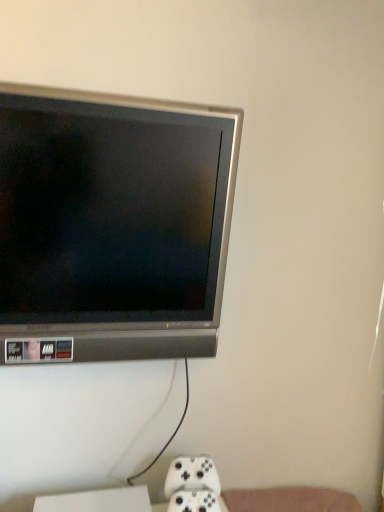
Question: In terms of width, does satin silver television at upper left look wider or thinner when compared to white matte game controller at lower center?

Choices:
 (A) thin
 (B) wide

Answer: (B)

Question: Does point (56, 269) appear closer or farther from the camera than point (190, 494)?

Choices:
 (A) closer
 (B) farther

Answer: (A)

Question: Based on their sizes in the image, would you say satin silver television at upper left is bigger or smaller than white matte game controller at lower center?

Choices:
 (A) big
 (B) small

Answer: (A)

Question: Is white matte game controller at lower center wider or thinner than satin silver television at upper left?

Choices:
 (A) thin
 (B) wide

Answer: (A)

Question: From a real-world perspective, relative to satin silver television at upper left, is white matte game controller at lower center vertically above or below?

Choices:
 (A) below
 (B) above

Answer: (A)

Question: Looking at the image, does white matte game controller at lower center seem bigger or smaller compared to satin silver television at upper left?

Choices:
 (A) big
 (B) small

Answer: (B)

Question: Is white matte game controller at lower center spatially inside satin silver television at upper left, or outside of it?

Choices:
 (A) inside
 (B) outside

Answer: (B)